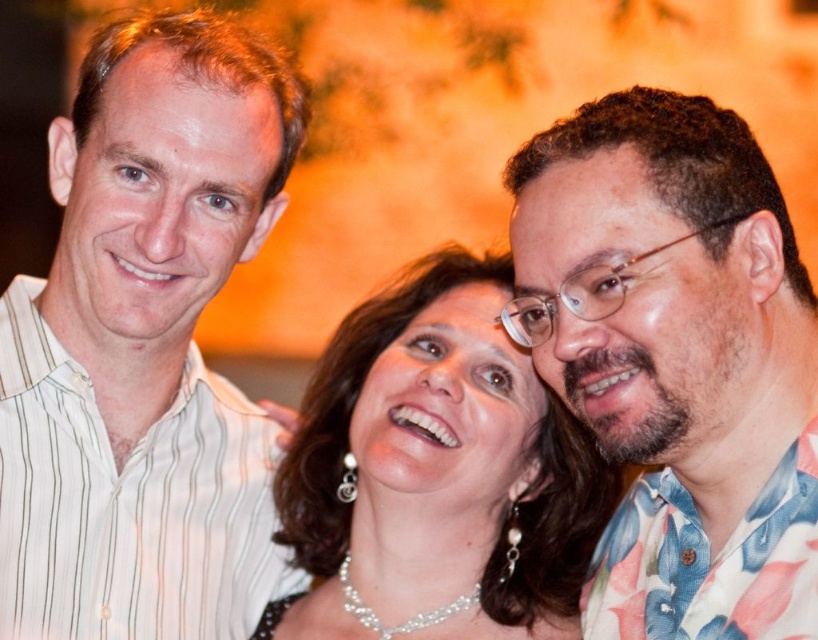
Question: Which point appears closest to the camera in this image?

Choices:
 (A) (336, 563)
 (B) (214, 376)
 (C) (748, 314)

Answer: (C)

Question: Which object appears closest to the camera in this image?

Choices:
 (A) pearl necklace at center
 (B) white striped shirt at left
 (C) floral print shirt at center

Answer: (C)

Question: Does floral print shirt at center lie in front of pearl necklace at center?

Choices:
 (A) yes
 (B) no

Answer: (A)

Question: Observing the image, what is the correct spatial positioning of floral print shirt at center in reference to pearl necklace at center?

Choices:
 (A) above
 (B) below

Answer: (A)

Question: Can you confirm if floral print shirt at center is positioned to the right of pearl necklace at center?

Choices:
 (A) yes
 (B) no

Answer: (A)

Question: Among these objects, which one is farthest from the camera?

Choices:
 (A) floral print shirt at center
 (B) white striped shirt at left

Answer: (B)